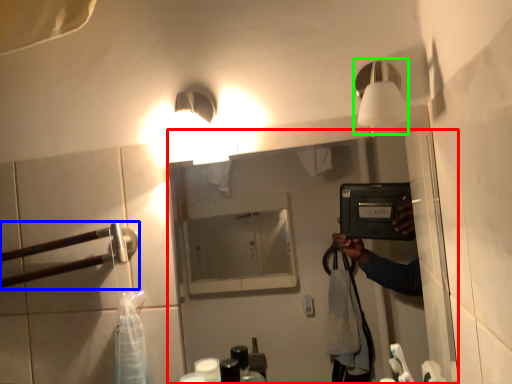
Question: Which object is positioned farthest from mirror (highlighted by a red box)? Select from door handle (highlighted by a blue box) and light fixture (highlighted by a green box).

Choices:
 (A) door handle
 (B) light fixture

Answer: (B)